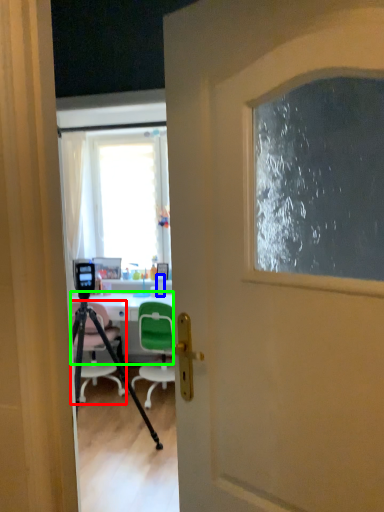
Question: Considering the real-world distances, which object is farthest from chair (highlighted by a red box)? bottle (highlighted by a blue box) or desk (highlighted by a green box)?

Choices:
 (A) bottle
 (B) desk

Answer: (A)